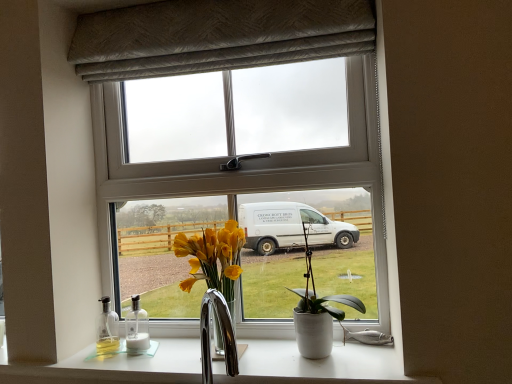
You are a GUI agent. You are given a task and a screenshot of the screen. Output one action in this format:
    pyautogui.click(x=<x>, y=<y>)
    Task: Click on the vacant space to the right of white ceramic pot at center
    The image size is (512, 384).
    Given the screenshot: What is the action you would take?
    pyautogui.click(x=370, y=357)